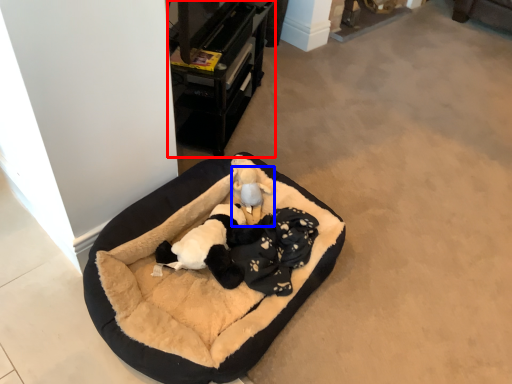
Question: Which object appears closest to the camera in this image, furniture (highlighted by a red box) or toy (highlighted by a blue box)?

Choices:
 (A) furniture
 (B) toy

Answer: (A)